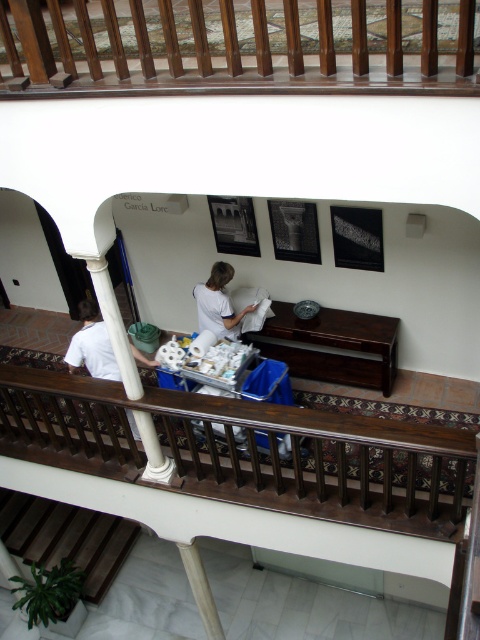
You are standing on the upper level of the building and want to place a potted plant on the dark wood table at center. Can you safely lower the plant down from the wooden railing at upper center to the table without it hitting the railing?

The wooden railing at upper center is above the dark wood table at center, so yes, you can safely lower the plant down from the wooden railing at upper center to the table without it hitting the railing.

You are standing on the upper level looking down. You need to walk down to the lower level where the cleaning staff is. Which object, the wooden railing at upper center or the wooden stairs at lower left, would you encounter first as you move toward the stairs?

You would encounter the wooden railing at upper center first because it is closer to you than the wooden stairs at lower left.